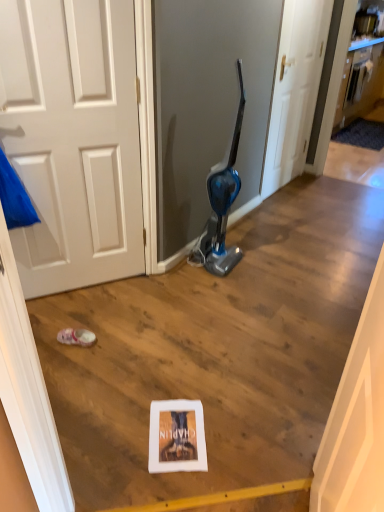
Describe the element at coordinates (76, 337) in the screenshot. This screenshot has width=384, height=512. I see `pink fabric shoe at lower left` at that location.

Where is `wooden cabinet at upper right`? The width and height of the screenshot is (384, 512). wooden cabinet at upper right is located at coordinates (360, 77).

Based on their positions, is wooden cabinet at upper right located to the left or right of pink fabric shoe at lower left?

From the image, it's evident that wooden cabinet at upper right is to the right of pink fabric shoe at lower left.

Considering the sizes of objects wooden cabinet at upper right and pink fabric shoe at lower left in the image provided, who is taller, wooden cabinet at upper right or pink fabric shoe at lower left?

wooden cabinet at upper right.

From a real-world perspective, does wooden cabinet at upper right sit lower than pink fabric shoe at lower left?

Incorrect, from a real-world perspective, wooden cabinet at upper right is higher than pink fabric shoe at lower left.

In the scene shown: Can you confirm if wooden cabinet at upper right is thinner than pink fabric shoe at lower left?

Correct, the width of wooden cabinet at upper right is less than that of pink fabric shoe at lower left.

Can you confirm if pink fabric shoe at lower left is positioned to the right of wooden cabinet at upper right?

No, pink fabric shoe at lower left is not to the right of wooden cabinet at upper right.

In terms of size, does pink fabric shoe at lower left appear bigger or smaller than wooden cabinet at upper right?

Considering their sizes, pink fabric shoe at lower left takes up less space than wooden cabinet at upper right.

How distant is pink fabric shoe at lower left from wooden cabinet at upper right?

A distance of 3.92 meters exists between pink fabric shoe at lower left and wooden cabinet at upper right.

Is pink fabric shoe at lower left oriented away from wooden cabinet at upper right?

No, pink fabric shoe at lower left's orientation is not away from wooden cabinet at upper right.

Does wooden cabinet at upper right come behind white matte door at center?

Yes, it is.

Which object is thinner, wooden cabinet at upper right or white matte door at center?

With smaller width is wooden cabinet at upper right.

Find the location of a particular element. This screenshot has width=384, height=512. cabinetry that is above the white matte door at center (from a real-world perspective) is located at coordinates (360, 77).

Is wooden cabinet at upper right far away from white matte door at center?

Indeed, wooden cabinet at upper right is not near white matte door at center.

From a real-world perspective, is white matte door at center physically below wooden cabinet at upper right?

Yes, from a real-world perspective, white matte door at center is below wooden cabinet at upper right.

Are white matte door at center and wooden cabinet at upper right beside each other?

No, white matte door at center is not in contact with wooden cabinet at upper right.

Consider the image. Can we say white matte door at center lies outside wooden cabinet at upper right?

That's correct, white matte door at center is outside of wooden cabinet at upper right.

How much distance is there between white matte door at center and wooden cabinet at upper right?

1.37 meters.

Which of these two, white matte door at center or pink fabric shoe at lower left, is bigger?

white matte door at center is bigger.

From the image's perspective, which one is positioned higher, white matte door at center or pink fabric shoe at lower left?

white matte door at center.

Considering the positions of objects white matte door at center and pink fabric shoe at lower left in the image provided, who is more to the right, white matte door at center or pink fabric shoe at lower left?

white matte door at center is more to the right.

Can you tell me how much white matte door at center and pink fabric shoe at lower left differ in facing direction?

There is a 115-degree angle between the facing directions of white matte door at center and pink fabric shoe at lower left.

Can you confirm if pink fabric shoe at lower left is positioned to the left of white matte door at center?

Yes, pink fabric shoe at lower left is to the left of white matte door at center.

Is white matte door at center completely or partially inside pink fabric shoe at lower left?

No, white matte door at center is located outside of pink fabric shoe at lower left.

Which is less distant, (x=69, y=342) or (x=312, y=84)?

Clearly, point (x=69, y=342) is closer to the camera than point (x=312, y=84).

From the image's perspective, relative to white matte door at center, is pink fabric shoe at lower left above or below?

pink fabric shoe at lower left is situated lower than white matte door at center in the image.

The width and height of the screenshot is (384, 512). I want to click on footwear that is on the left side of wooden cabinet at upper right, so click(76, 337).

Identify the location of footwear below the wooden cabinet at upper right (from a real-world perspective). The image size is (384, 512). pos(76,337).

In the scene shown: Looking at the image, which one is located closer to white matte door at center, wooden cabinet at upper right or pink fabric shoe at lower left?

The object closer to white matte door at center is wooden cabinet at upper right.

Estimate the real-world distances between objects in this image. Which object is closer to pink fabric shoe at lower left, wooden cabinet at upper right or white matte door at center?

white matte door at center is closer to pink fabric shoe at lower left.

Considering their positions, is white matte door at center positioned further to pink fabric shoe at lower left than wooden cabinet at upper right?

wooden cabinet at upper right is further to pink fabric shoe at lower left.

Based on their spatial positions, is pink fabric shoe at lower left or wooden cabinet at upper right further from white matte door at center?

pink fabric shoe at lower left is positioned further to the anchor white matte door at center.

When comparing their distances from wooden cabinet at upper right, does white matte door at center or pink fabric shoe at lower left seem further?

pink fabric shoe at lower left lies further to wooden cabinet at upper right than the other object.

Which object lies further to the anchor point wooden cabinet at upper right, pink fabric shoe at lower left or white matte door at center?

pink fabric shoe at lower left is positioned further to the anchor wooden cabinet at upper right.

Locate an element on the screen. This screenshot has height=512, width=384. door between pink fabric shoe at lower left and wooden cabinet at upper right is located at coordinates (295, 90).